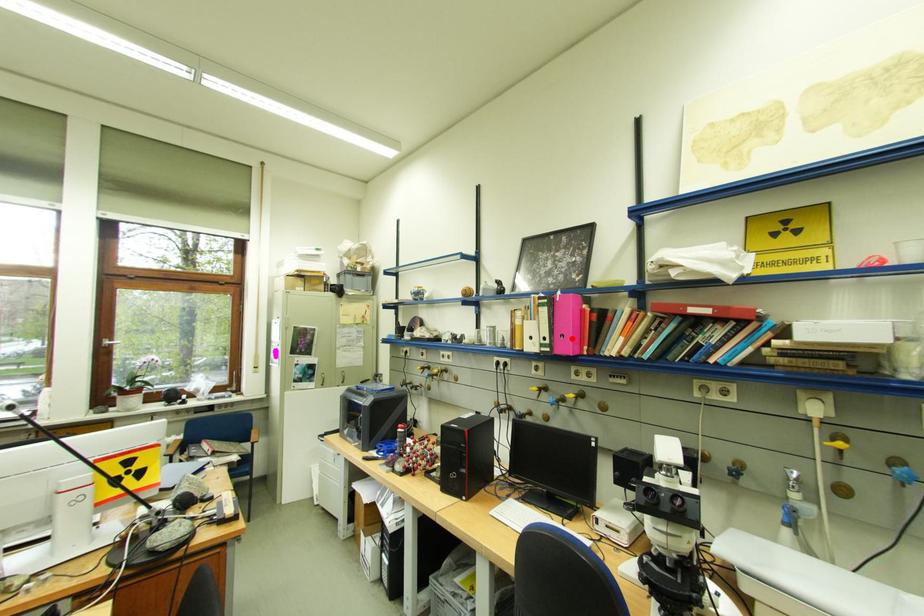
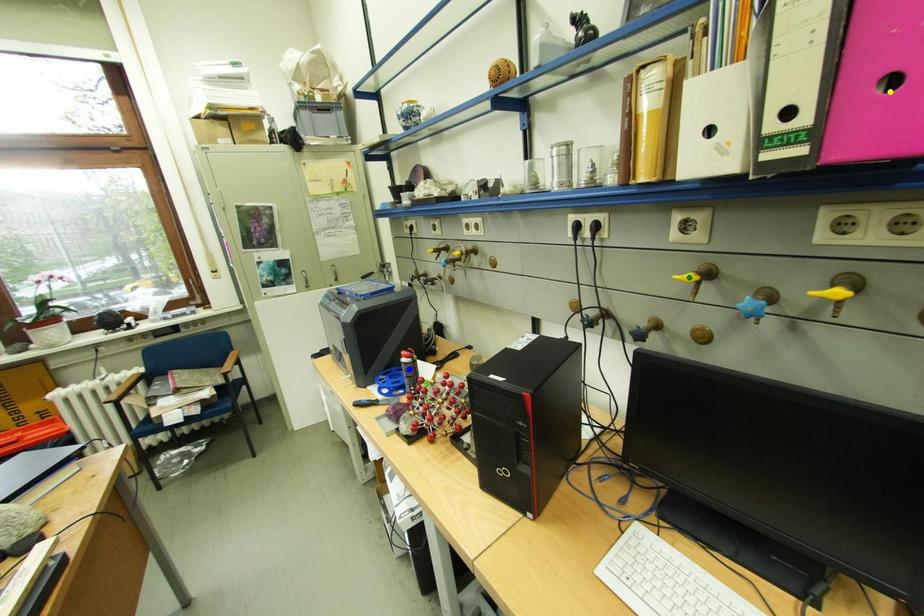
Question: I am providing you with two images of the same scene from different viewpoints. A red point is marked on the first image. You are given multiple points on the second image. Which point in image 2 represents the same 3d spot as the red point in image 1?

Choices:
 (A) blue point
 (B) yellow point
 (C) green point

Answer: (B)